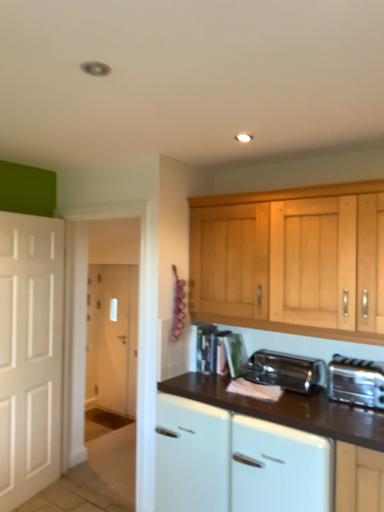
This screenshot has width=384, height=512. In order to click on free space in front of satin chrome toaster at lower center in this screenshot , I will do `click(304, 401)`.